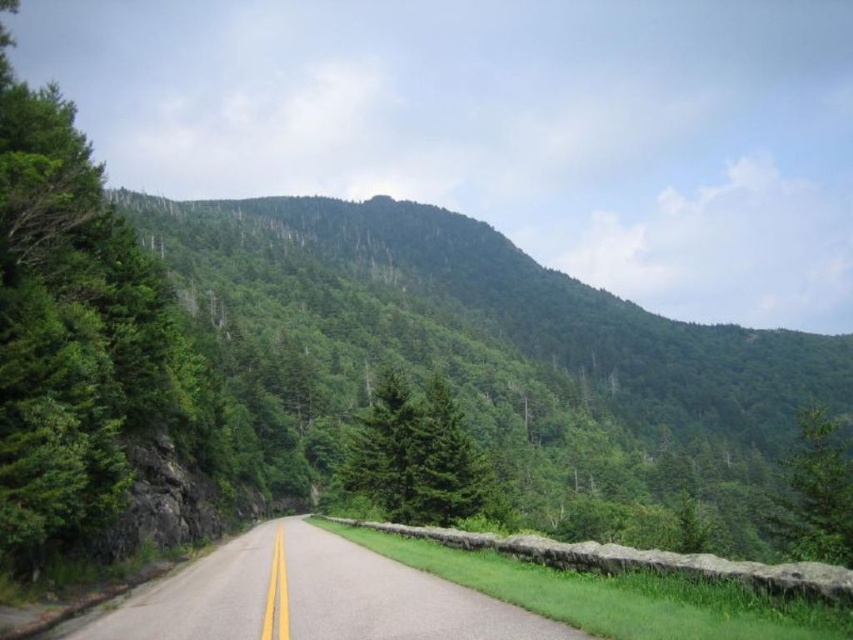
Question: Can you confirm if asphalt road at center is positioned above green leafy tree at right?

Choices:
 (A) no
 (B) yes

Answer: (B)

Question: Can you confirm if green matte tree at center is smaller than green leafy tree at right?

Choices:
 (A) no
 (B) yes

Answer: (B)

Question: Which of the following is the farthest from the observer?

Choices:
 (A) (463, 488)
 (B) (784, 538)
 (C) (173, 634)

Answer: (A)

Question: Does green matte tree at center have a greater width compared to green leafy tree at right?

Choices:
 (A) no
 (B) yes

Answer: (A)

Question: Which object is farther from the camera taking this photo?

Choices:
 (A) green matte tree at center
 (B) asphalt road at center

Answer: (A)

Question: Which is farther from the asphalt road at center?

Choices:
 (A) green leafy tree at right
 (B) green matte tree at center

Answer: (A)